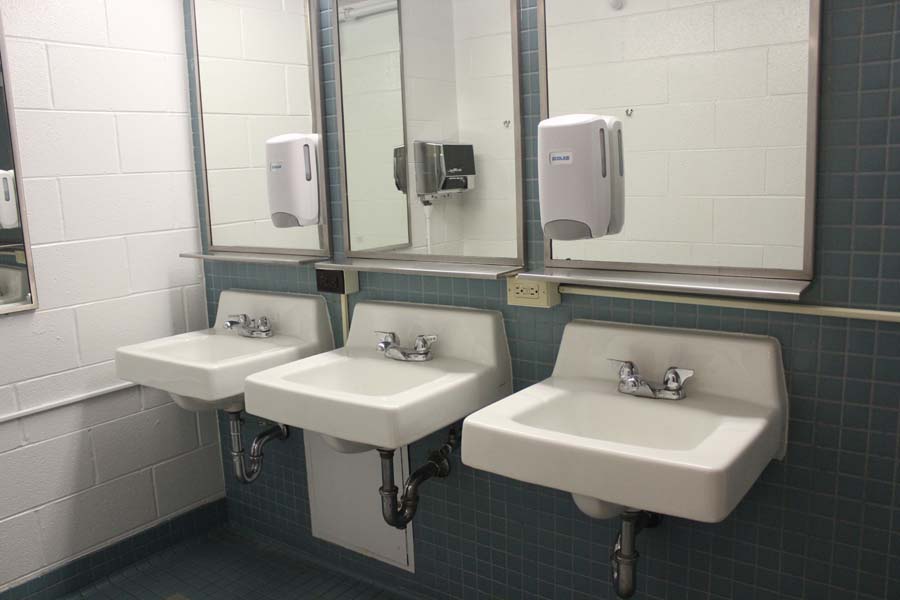
Identify the location of mirror. The height and width of the screenshot is (600, 900). (716, 115), (448, 83), (258, 66).